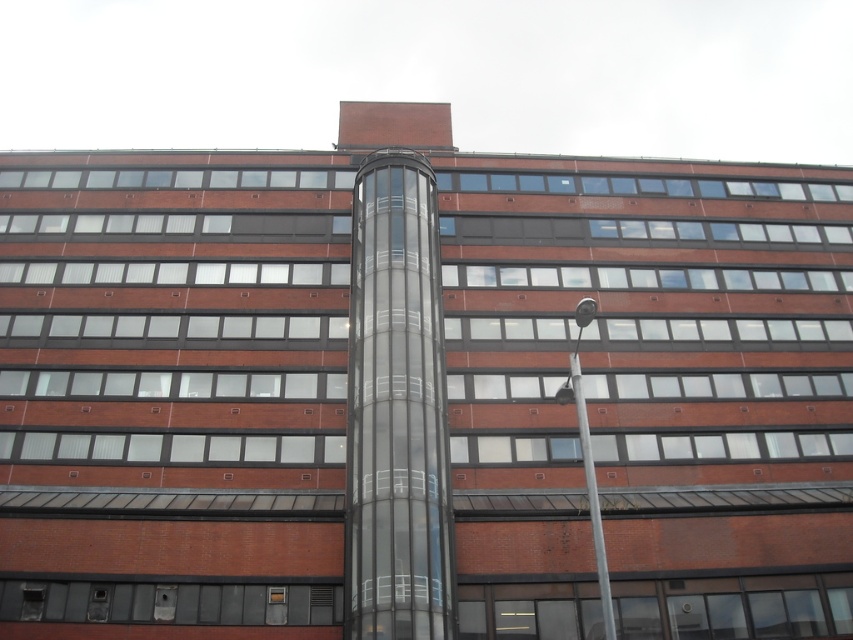
Question: Is transparent glass elevator at center bigger than silver metallic pole at upper right?

Choices:
 (A) yes
 (B) no

Answer: (A)

Question: Which point is farther to the camera?

Choices:
 (A) (608, 628)
 (B) (369, 557)

Answer: (B)

Question: Observing the image, what is the correct spatial positioning of transparent glass elevator at center in reference to silver metallic pole at upper right?

Choices:
 (A) below
 (B) above

Answer: (B)

Question: Does transparent glass elevator at center have a smaller size compared to silver metallic pole at upper right?

Choices:
 (A) yes
 (B) no

Answer: (B)

Question: Among these objects, which one is farthest from the camera?

Choices:
 (A) transparent glass elevator at center
 (B) silver metallic pole at upper right

Answer: (A)